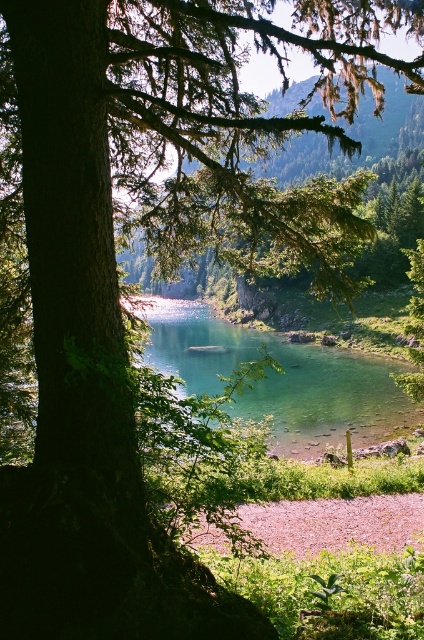
You are a hiker who wants to cross the pink gravel shore at lower center to reach the clear glass water at center. Is the path from the shore to the water going uphill or downhill?

The clear glass water at center is closer to the viewer than the pink gravel shore at lower center, so the path from the shore to the water is going downhill.

You are standing at the edge of the pink gravel shore at lower center and want to reach the clear glass water at center. Which direction should you move to get there?

You should move to the left because the clear glass water at center is located to the left of the pink gravel shore at lower center.